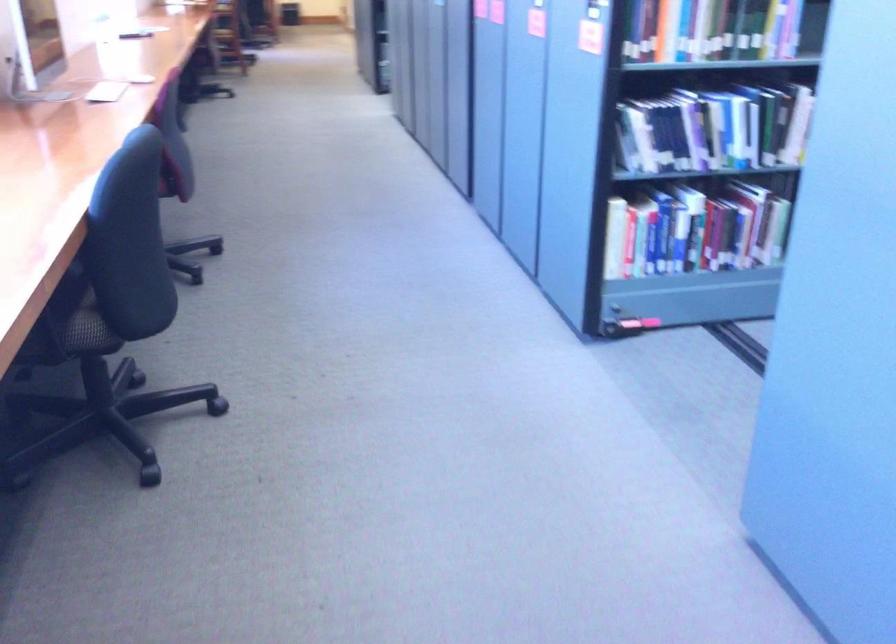
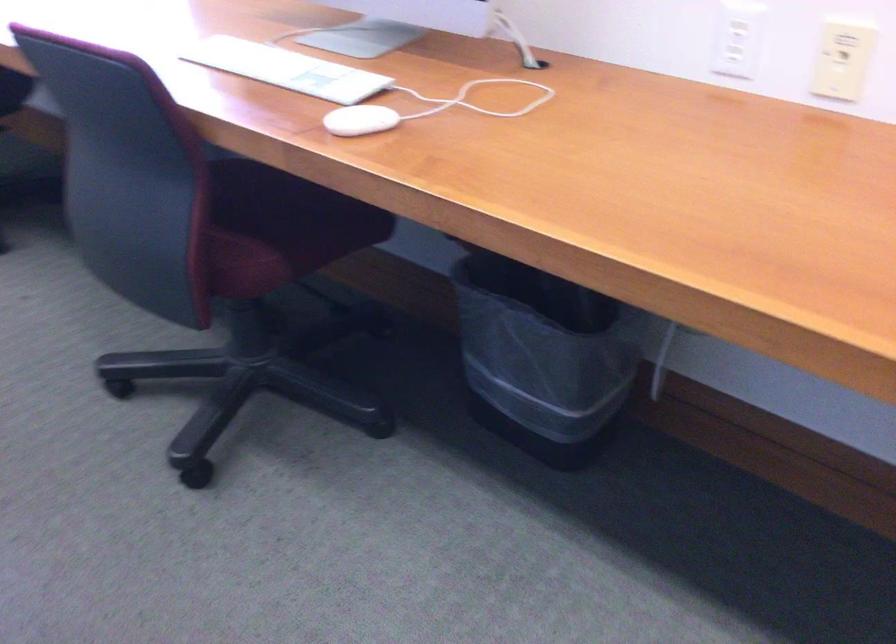
Find the pixel in the second image that matches the point at 123,86 in the first image.

(286, 69)